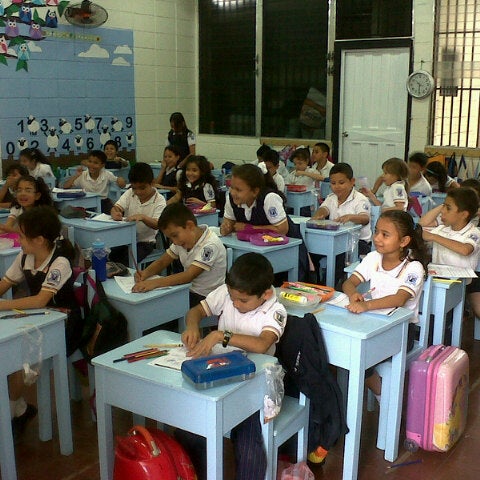
This screenshot has width=480, height=480. I want to click on white door, so click(377, 104).